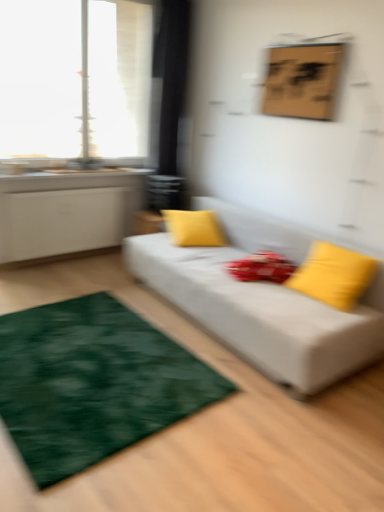
The width and height of the screenshot is (384, 512). Identify the location of empty space that is in between white fabric couch at center and green plush rug at lower left. (182, 339).